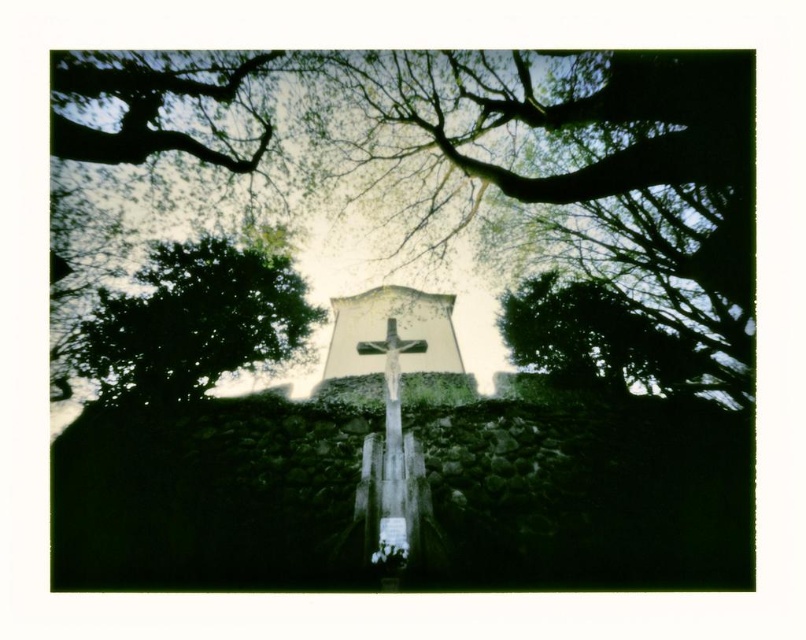
You are standing in front of the white matte cross at center and want to walk towards the green leafy tree at center. Which direction should you move to get closer to the tree?

The green leafy tree at center is closer to the viewer than the white matte cross at center. To move towards the tree, you should step backward away from the cross since the tree is nearer to your current position.

You are standing in the middle of the scene and want to place a 5 meter long banner between the green leafy tree at center and the white matte cross at center. Is there enough space to stretch the banner without bending it?

The green leafy tree at center is 4.62 meters away from the white matte cross at center. Since the banner is 5 meters long, there is not enough space to stretch it without bending it.

In the scene shown: You are standing in front of a crucifix scene with a white matte cross at center and a wooden cross at center. Which cross is closer to you?

The white matte cross at center is 8.59 meters away from the wooden cross at center. Therefore, the wooden cross at center is closer to you since it is positioned behind the white matte cross at center.